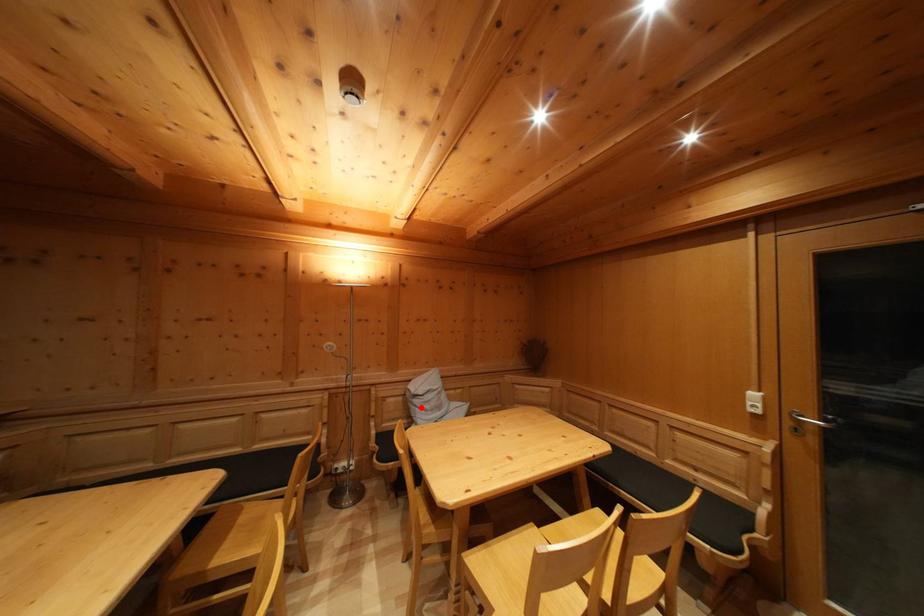
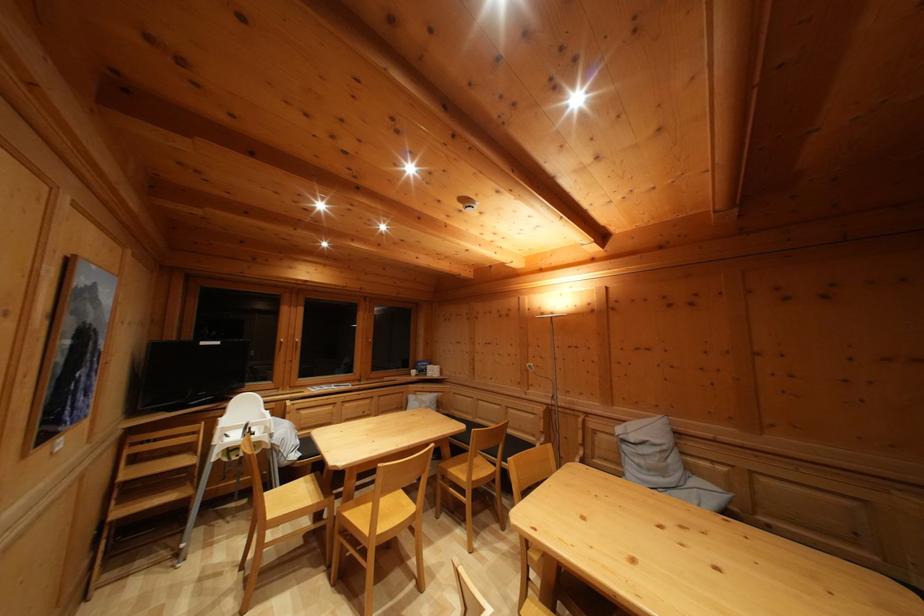
In the second image, find the point that corresponds to the highlighted location in the first image.

(629, 454)